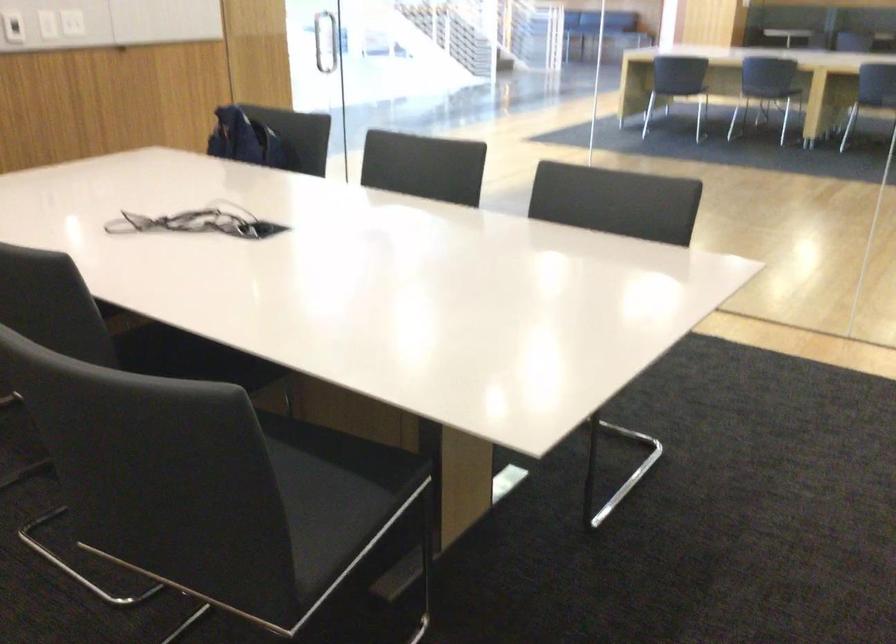
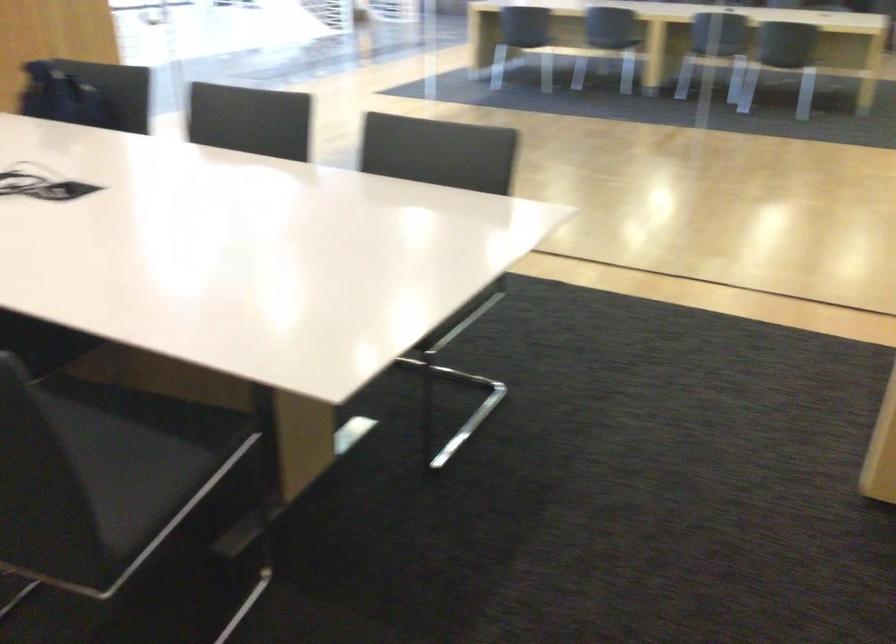
Question: The images are taken continuously from a first-person perspective. In which direction is your viewpoint rotating?

Choices:
 (A) Left
 (B) Right
 (C) Up
 (D) Down

Answer: (B)